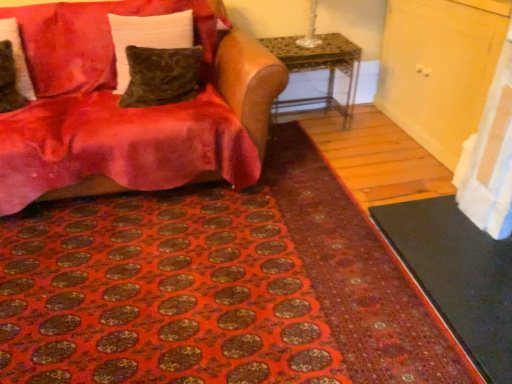
The width and height of the screenshot is (512, 384). In order to click on vacant space underneath metallic mosaic table at center (from a real-world perspective) in this screenshot , I will do `click(308, 113)`.